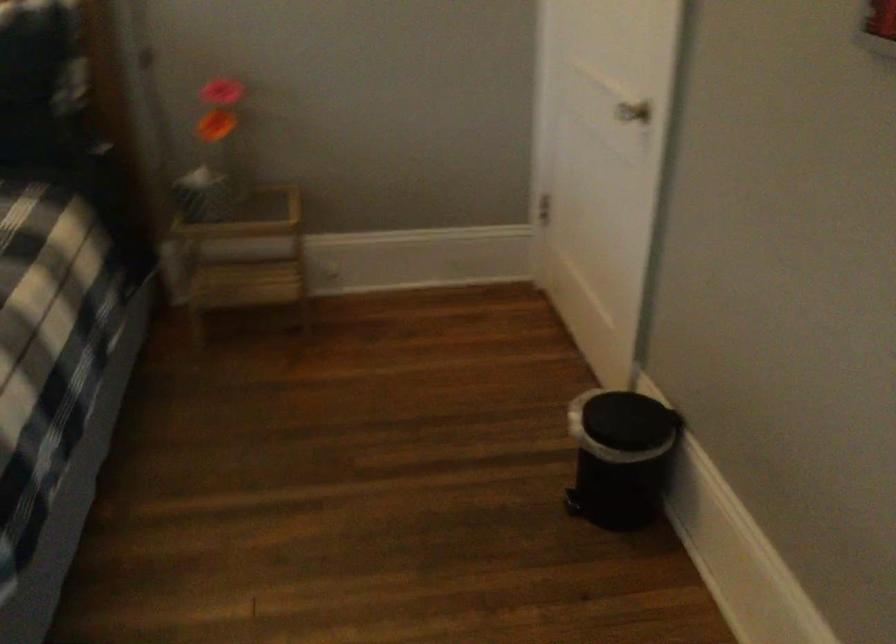
Locate an element on the screen. black trash can lid is located at coordinates (622, 424).